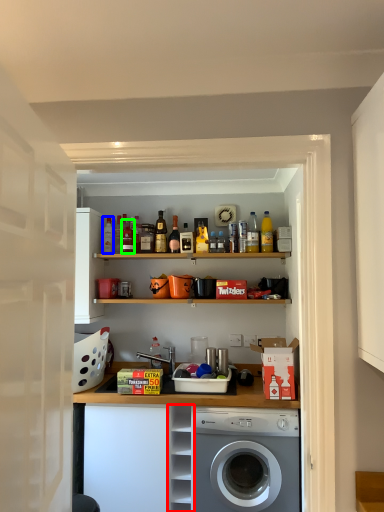
Question: Considering the real-world distances, which object is closest to cabinet (highlighted by a red box)? bottle (highlighted by a blue box) or bottle (highlighted by a green box).

Choices:
 (A) bottle
 (B) bottle

Answer: (B)